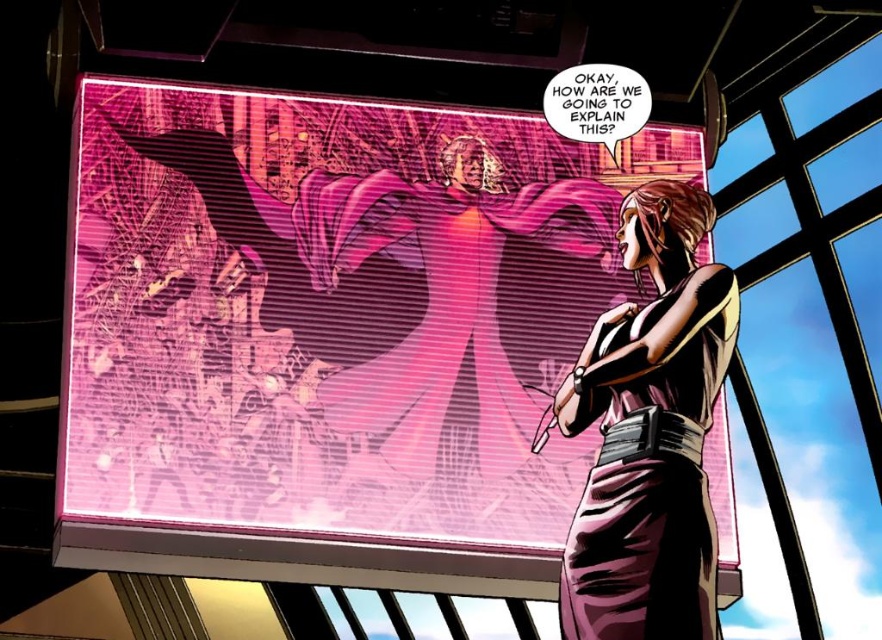
Question: Which point is farther to the camera?

Choices:
 (A) smooth purple pants at center
 (B) shiny purple dress at center

Answer: (A)

Question: Is smooth purple pants at center thinner than shiny purple dress at center?

Choices:
 (A) no
 (B) yes

Answer: (A)

Question: Is smooth purple pants at center thinner than shiny purple dress at center?

Choices:
 (A) yes
 (B) no

Answer: (B)

Question: Observing the image, what is the correct spatial positioning of smooth purple pants at center in reference to shiny purple dress at center?

Choices:
 (A) right
 (B) left

Answer: (B)

Question: Which object appears closest to the camera in this image?

Choices:
 (A) smooth purple pants at center
 (B) shiny purple dress at center

Answer: (B)

Question: Which of the following is the closest to the observer?

Choices:
 (A) (652, 228)
 (B) (445, 301)

Answer: (A)